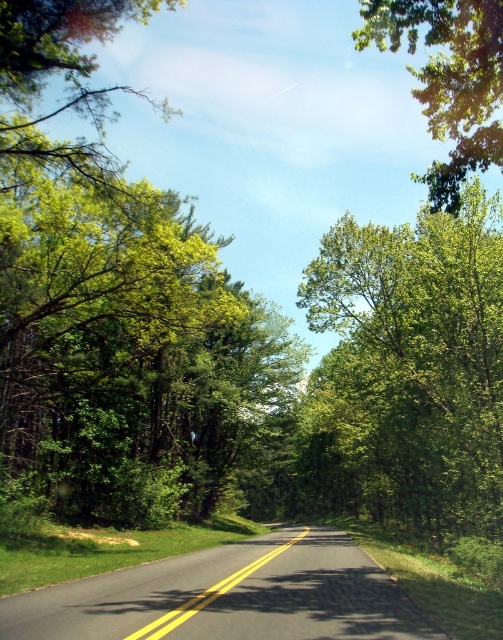
Question: Which point is farther from the camera taking this photo?

Choices:
 (A) (400, 333)
 (B) (462, 13)

Answer: (A)

Question: From the image, what is the correct spatial relationship of green leafy tree at center in relation to green leafy tree at upper right?

Choices:
 (A) below
 (B) above

Answer: (A)

Question: Can you confirm if green leafy tree at center is positioned to the right of green leafy tree at upper right?

Choices:
 (A) yes
 (B) no

Answer: (B)

Question: Is green leafy tree at center positioned in front of green leafy tree at upper right?

Choices:
 (A) yes
 (B) no

Answer: (B)

Question: Which object appears farthest from the camera in this image?

Choices:
 (A) green leafy tree at upper right
 (B) green leafy tree at center

Answer: (B)

Question: Which point is closer to the camera?

Choices:
 (A) green leafy tree at center
 (B) green leafy tree at upper right

Answer: (B)